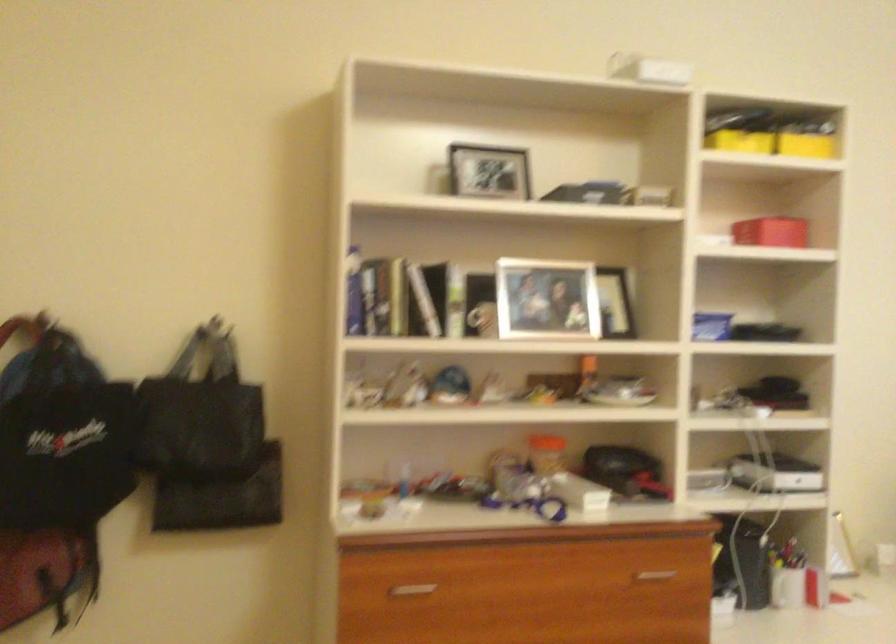
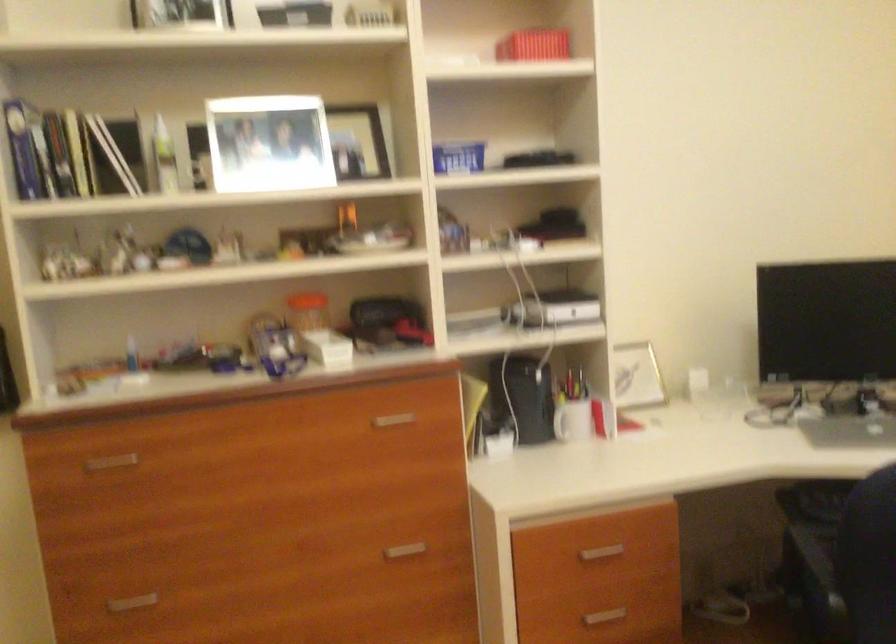
Question: Which direction would the cameraman need to move to produce the second image? Reply with the corresponding letter.

Choices:
 (A) Left
 (B) Right
 (C) Forward
 (D) Backward

Answer: (B)